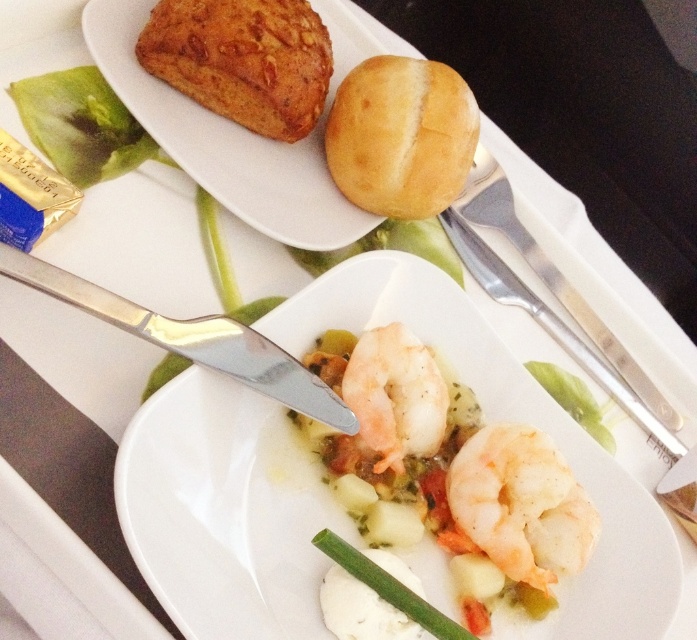
Question: Which object appears closest to the camera in this image?

Choices:
 (A) green smoothmaterial/texture asparagus at lower center
 (B) white glossy plate at center
 (C) golden brown crumbly bread at upper left
 (D) white glossy shrimp at center

Answer: (B)

Question: Which object appears closest to the camera in this image?

Choices:
 (A) green smoothmaterial/texture asparagus at lower center
 (B) golden matte bun at upper center

Answer: (A)

Question: Does golden brown crumbly bread at upper left appear over green smoothmaterial/texture asparagus at lower center?

Choices:
 (A) no
 (B) yes

Answer: (B)

Question: Which point is farther to the camera?

Choices:
 (A) pos(273,88)
 (B) pos(618,364)
 (C) pos(245,376)

Answer: (B)

Question: Is golden matte bun at upper center smaller than satin silver knife at upper left?

Choices:
 (A) yes
 (B) no

Answer: (A)

Question: Does golden brown crumbly bread at upper left appear on the left side of white glossy shrimp at center?

Choices:
 (A) yes
 (B) no

Answer: (A)